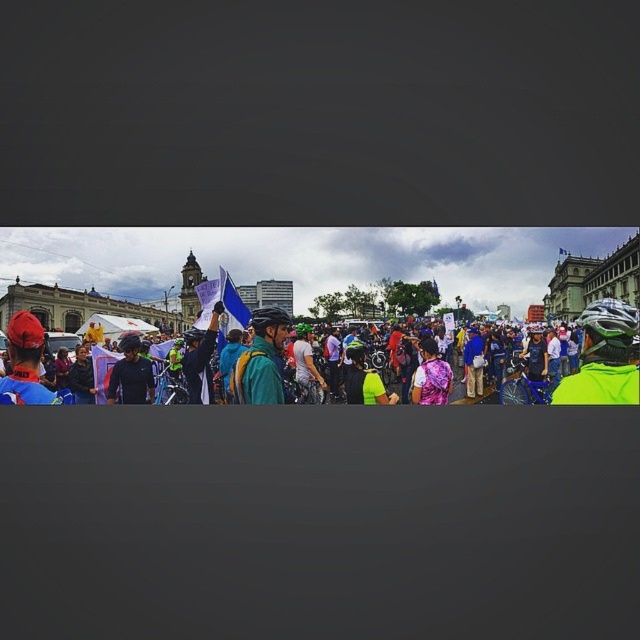
Question: Can you confirm if pink sequined dress at center is thinner than matte black helmet at center?

Choices:
 (A) yes
 (B) no

Answer: (A)

Question: Which object appears farthest from the camera in this image?

Choices:
 (A) green matte bicycle helmet at center-right
 (B) matte black helmet at center

Answer: (B)

Question: Can you confirm if neon yellow jacket at center is bigger than green matte bicycle helmet at center-right?

Choices:
 (A) no
 (B) yes

Answer: (B)

Question: Which is farther from the pink sequined dress at center?

Choices:
 (A) neon yellow jacket at center
 (B) matte black helmet at center

Answer: (B)

Question: Can you confirm if pink sequined dress at center is positioned above matte black helmet at center?

Choices:
 (A) yes
 (B) no

Answer: (B)

Question: Which point is closer to the camera?

Choices:
 (A) (445, 371)
 (B) (12, 323)
 (C) (266, 317)

Answer: (B)